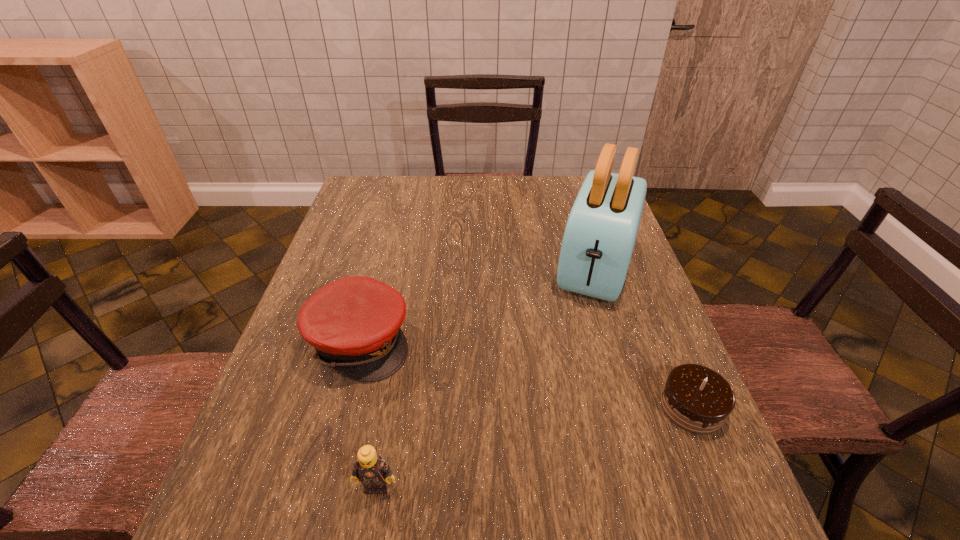
The height and width of the screenshot is (540, 960). Identify the location of free spot on the desktop that is between the Lego and the chocolate cake and is positioned on the side of the toaster with the lever. (538, 446).

Locate an element on the screen. free space on the desktop that is between the nearest object and the chocolate cake and is positioned on the front of the cap with an emblem is located at coordinates (586, 434).